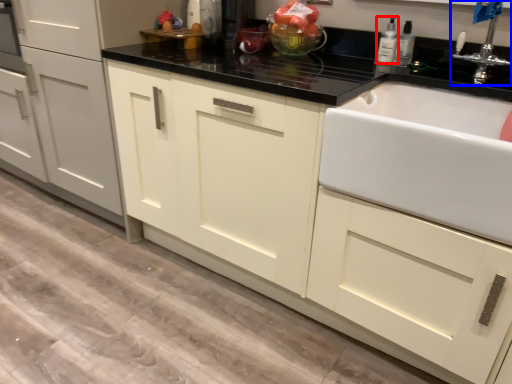
Question: Which of the following is the farthest to the observer, bottle (highlighted by a red box) or tap (highlighted by a blue box)?

Choices:
 (A) bottle
 (B) tap

Answer: (A)